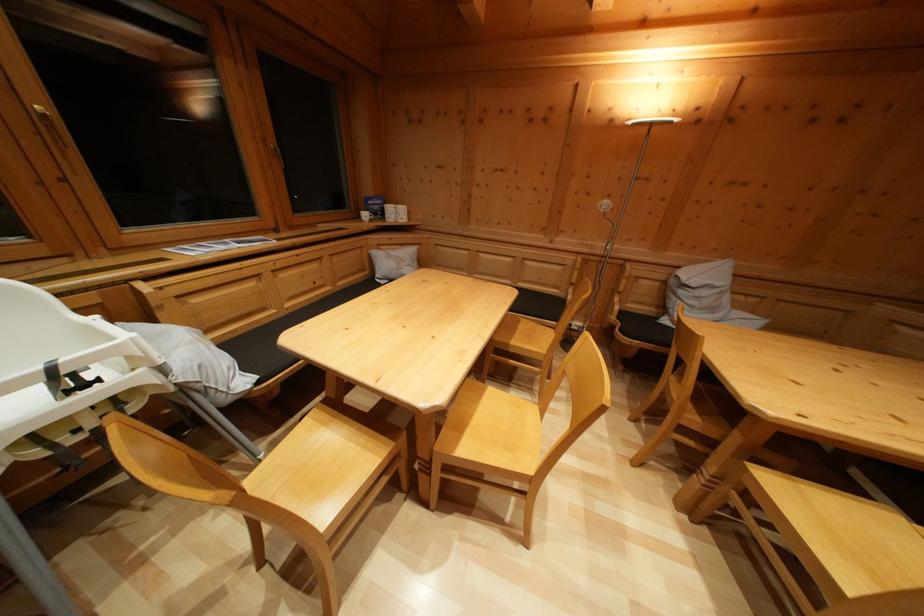
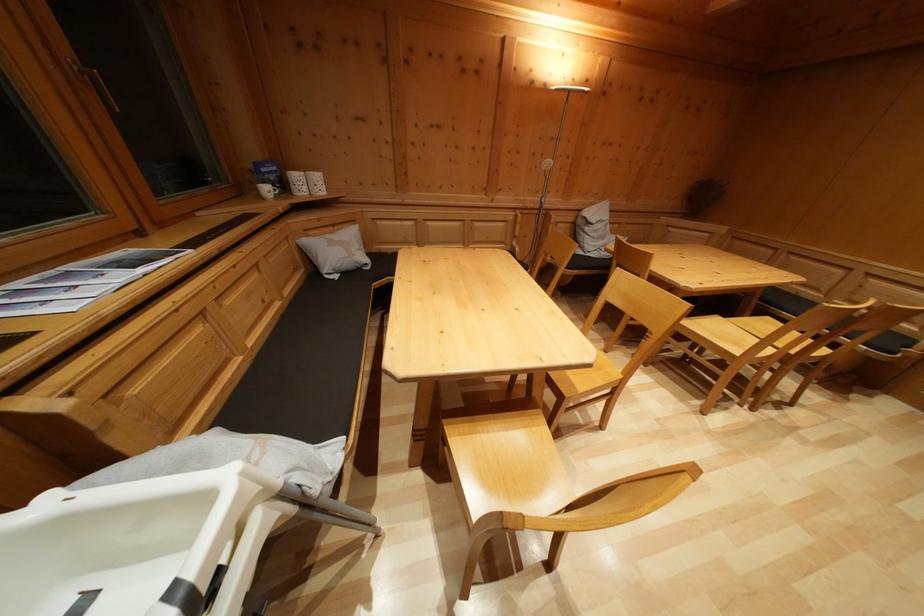
Question: The first image is from the beginning of the video and the second image is from the end. How did the camera likely rotate when shooting the video?

Choices:
 (A) Left
 (B) Right
 (C) Up
 (D) Down

Answer: (B)